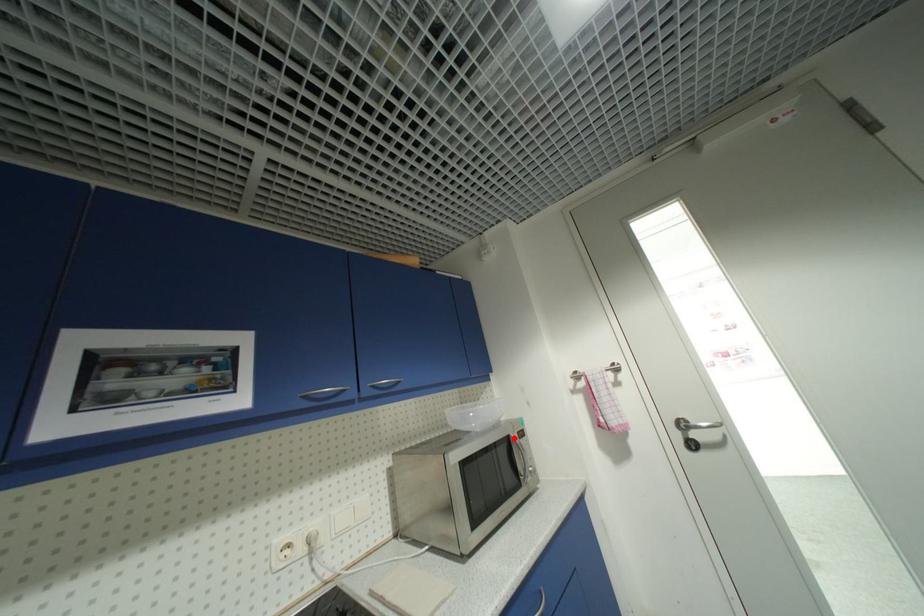
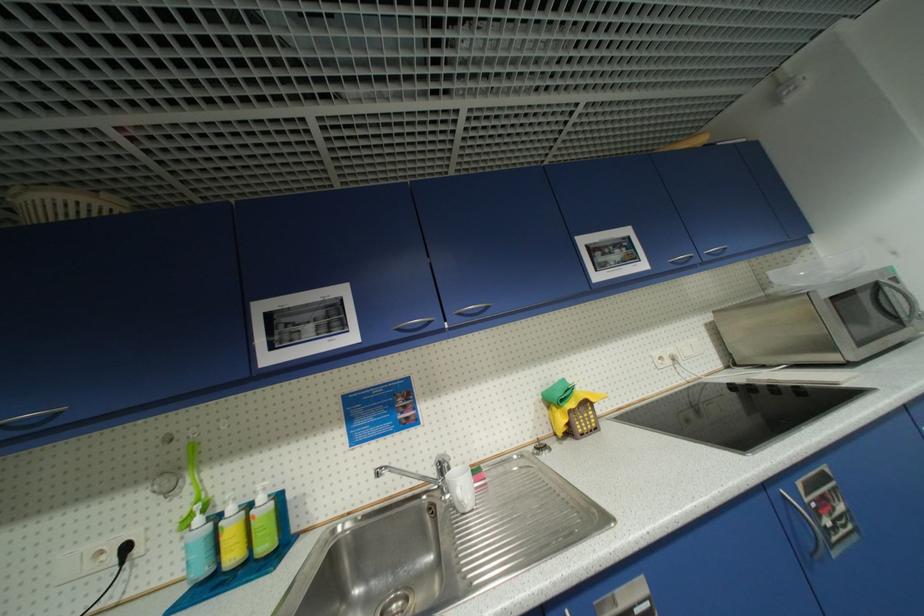
Question: I am providing you with two images of the same scene from different viewpoints. Image1 has a red point marked. In image2, the corresponding 3D location appears at what relative position? Reply with the corresponding letter.

Choices:
 (A) Closer
 (B) Farther

Answer: (A)